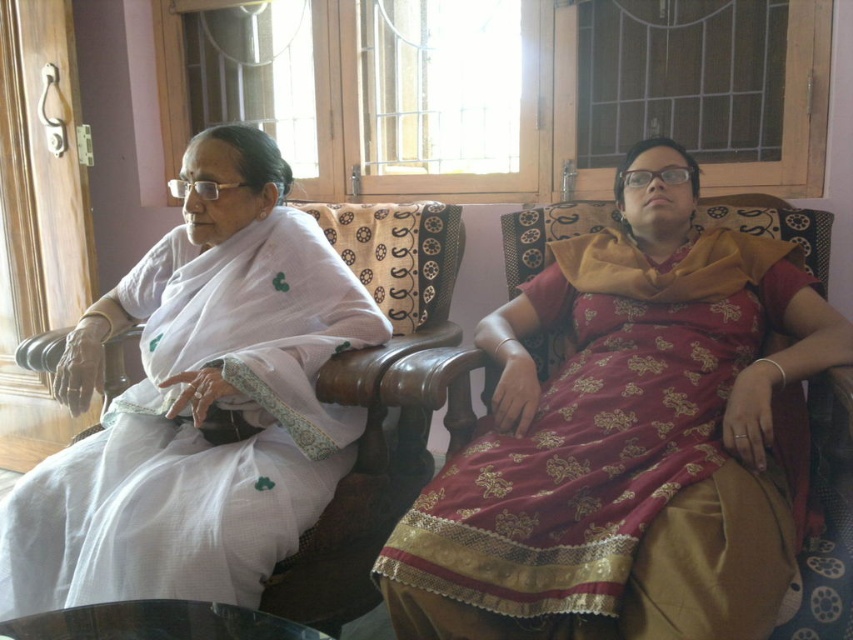
Question: Can you confirm if maroon satin saree at center is wider than white cotton saree at left?

Choices:
 (A) yes
 (B) no

Answer: (A)

Question: Among these points, which one is nearest to the camera?

Choices:
 (A) (244, 252)
 (B) (456, 628)

Answer: (B)

Question: Is maroon satin saree at center bigger than white cotton saree at left?

Choices:
 (A) yes
 (B) no

Answer: (A)

Question: Where is maroon satin saree at center located in relation to white cotton saree at left in the image?

Choices:
 (A) left
 (B) right

Answer: (B)

Question: Which point is closer to the camera taking this photo?

Choices:
 (A) (431, 636)
 (B) (253, 362)

Answer: (A)